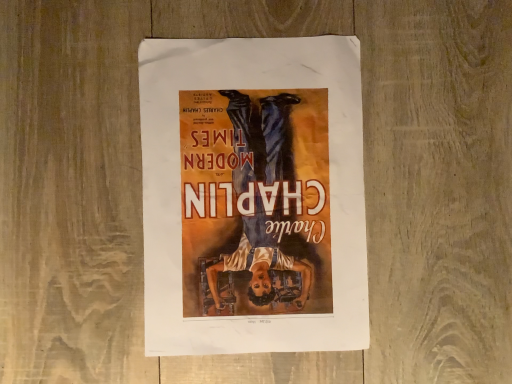
Image resolution: width=512 pixels, height=384 pixels. I want to click on free space above matte paper poster at center (from a real-world perspective), so click(248, 195).